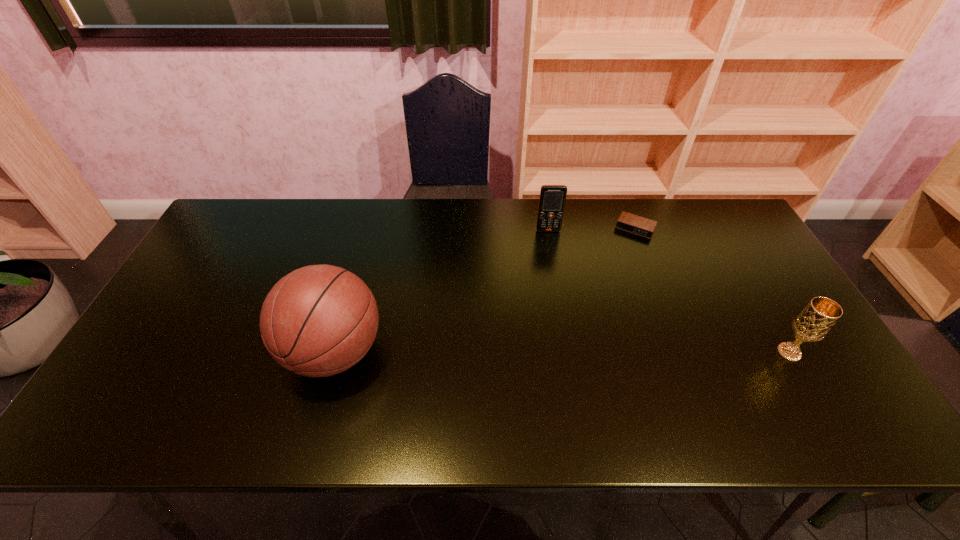
This screenshot has width=960, height=540. What are the coordinates of `vacant space located on the screen of the cellular telephone` in the screenshot? It's located at (559, 300).

Where is `free space located on the front face of the third object from left to right`? The width and height of the screenshot is (960, 540). free space located on the front face of the third object from left to right is located at coordinates (600, 296).

Identify the location of blank space located 0.360m on the front face of the third object from left to right. This screenshot has width=960, height=540. (591, 313).

Where is `vacant region located on the front face of the third object from left to right`? This screenshot has height=540, width=960. vacant region located on the front face of the third object from left to right is located at coordinates (615, 264).

Identify the location of cellular telephone located in the far edge section of the desktop. The image size is (960, 540). (552, 200).

This screenshot has width=960, height=540. Find the location of `alarm clock at the far edge`. alarm clock at the far edge is located at coordinates (628, 222).

Locate an element on the screen. object situated at the near edge is located at coordinates (319, 320).

This screenshot has width=960, height=540. In order to click on object that is at the right edge in this screenshot , I will do `click(813, 323)`.

In the image, there is a desktop. Where is `vacant space at the far edge`? This screenshot has height=540, width=960. vacant space at the far edge is located at coordinates (564, 233).

Find the location of a particular element. This screenshot has height=540, width=960. free space at the near edge of the desktop is located at coordinates (622, 377).